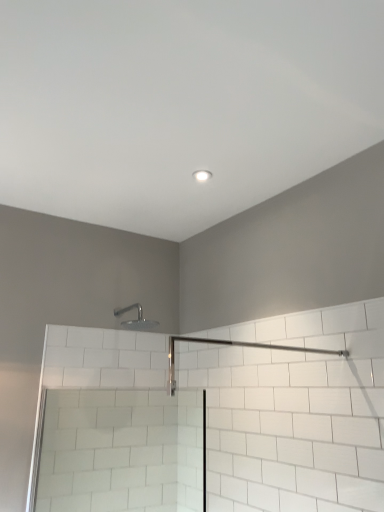
Question: Considering the relative positions of clear glass screen door at lower left and silver metallic shower head at upper center in the image provided, is clear glass screen door at lower left to the left or to the right of silver metallic shower head at upper center?

Choices:
 (A) right
 (B) left

Answer: (B)

Question: From the image's perspective, is clear glass screen door at lower left located above or below silver metallic shower head at upper center?

Choices:
 (A) above
 (B) below

Answer: (B)

Question: Which object is positioned farthest from the clear glass screen door at lower left?

Choices:
 (A) silver metallic shower head at upper center
 (B) white glossy light fixture at upper center

Answer: (B)

Question: Estimate the real-world distances between objects in this image. Which object is closer to the clear glass screen door at lower left?

Choices:
 (A) silver metallic shower head at upper center
 (B) white glossy light fixture at upper center

Answer: (A)